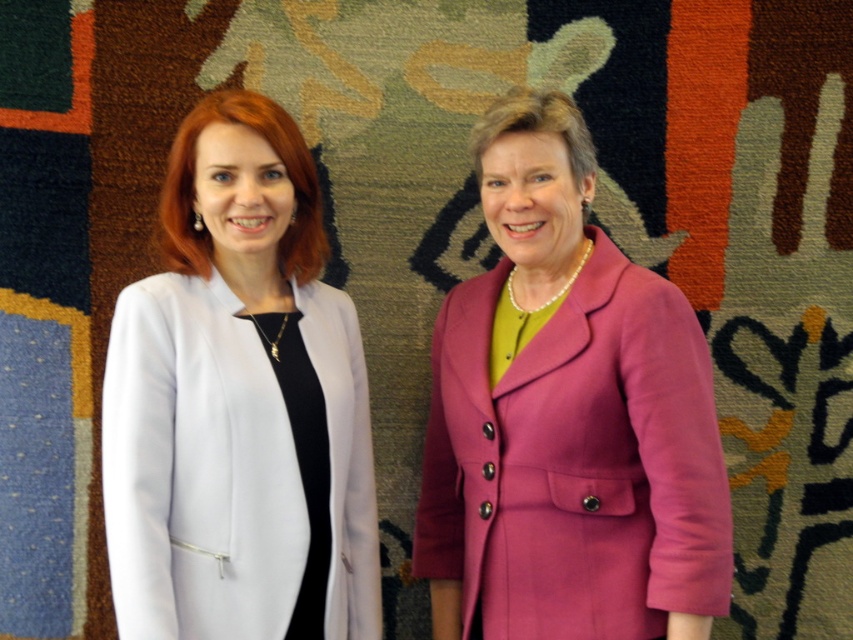
Question: Is purple woolen coat at center below white smooth coat at left?

Choices:
 (A) yes
 (B) no

Answer: (B)

Question: Does purple woolen coat at center have a lesser width compared to white smooth coat at left?

Choices:
 (A) yes
 (B) no

Answer: (B)

Question: Which point is closer to the camera?

Choices:
 (A) purple woolen coat at center
 (B) white smooth coat at left

Answer: (A)

Question: Is purple woolen coat at center to the left of white smooth coat at left from the viewer's perspective?

Choices:
 (A) yes
 (B) no

Answer: (B)

Question: Which object appears closest to the camera in this image?

Choices:
 (A) white smooth coat at left
 (B) purple woolen coat at center

Answer: (B)